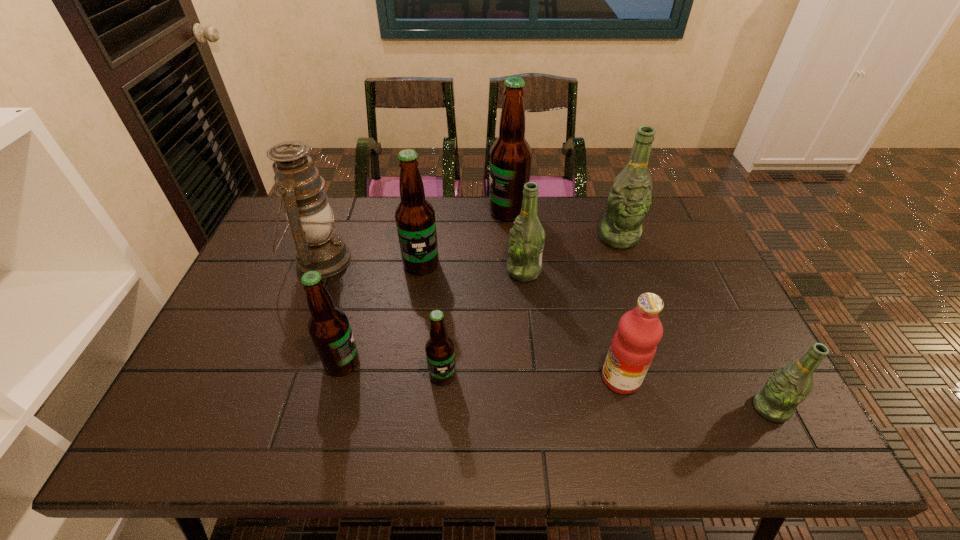
Where is `empty location between the third beer bottle from left to right and the leftmost object`? The image size is (960, 540). empty location between the third beer bottle from left to right and the leftmost object is located at coordinates (382, 317).

You are a GUI agent. You are given a task and a screenshot of the screen. Output one action in this format:
    pyautogui.click(x=<x>, y=<y>)
    Task: Click on the blank region between the seventh object from right to left and the farthest beer bottle
    
    Given the screenshot: What is the action you would take?
    pyautogui.click(x=465, y=238)

Find the location of a particular element. free spot between the rightmost beer bottle and the third object from left to right is located at coordinates (595, 336).

Where is `object that ranks as the closest to the leftmost green beer bottle`? This screenshot has height=540, width=960. object that ranks as the closest to the leftmost green beer bottle is located at coordinates (510, 156).

Image resolution: width=960 pixels, height=540 pixels. I want to click on object that is the fifth closest to the second smallest brown beer bottle, so click(x=633, y=347).

Image resolution: width=960 pixels, height=540 pixels. I want to click on beer bottle that is the fourth closest one to the second smallest green beer bottle, so click(x=440, y=352).

Where is `beer bottle that is the third closest to the smallest brown beer bottle`? The image size is (960, 540). beer bottle that is the third closest to the smallest brown beer bottle is located at coordinates (526, 241).

Identify which brown beer bottle is the fourth closest to the sixth nearest beer bottle. Please provide its 2D coordinates. Your answer should be formatted as a tuple, i.e. [(x, y)], where the tuple contains the x and y coordinates of a point satisfying the conditions above.

[(329, 328)]

Choose which brown beer bottle is the third nearest neighbor to the leftmost beer bottle. Please provide its 2D coordinates. Your answer should be formatted as a tuple, i.e. [(x, y)], where the tuple contains the x and y coordinates of a point satisfying the conditions above.

[(510, 156)]

Identify which green beer bottle is the nearest to the nearest beer bottle. Please provide its 2D coordinates. Your answer should be formatted as a tuple, i.e. [(x, y)], where the tuple contains the x and y coordinates of a point satisfying the conditions above.

[(628, 202)]